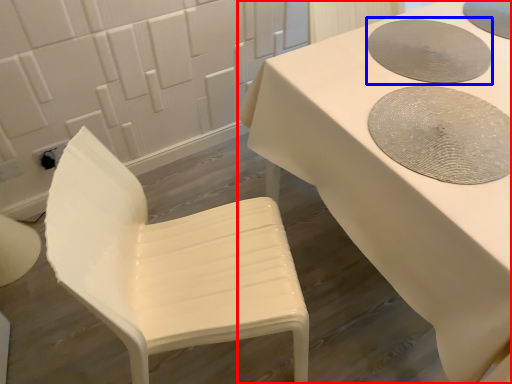
Question: Which of the following is the closest to the observer, table (highlighted by a red box) or manhole cover (highlighted by a blue box)?

Choices:
 (A) table
 (B) manhole cover

Answer: (A)